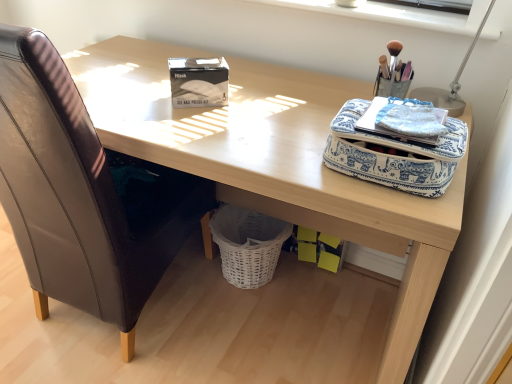
The height and width of the screenshot is (384, 512). In order to click on free space to the back side of white matte gel nail polish kit at upper center in this screenshot , I will do `click(229, 74)`.